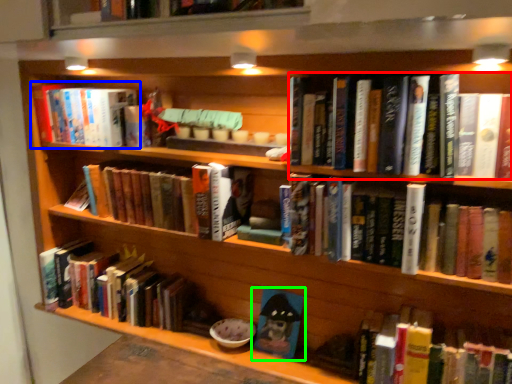
Question: Which object is positioned farthest from book (highlighted by a red box)? Select from book (highlighted by a blue box) and book (highlighted by a green box).

Choices:
 (A) book
 (B) book

Answer: (A)